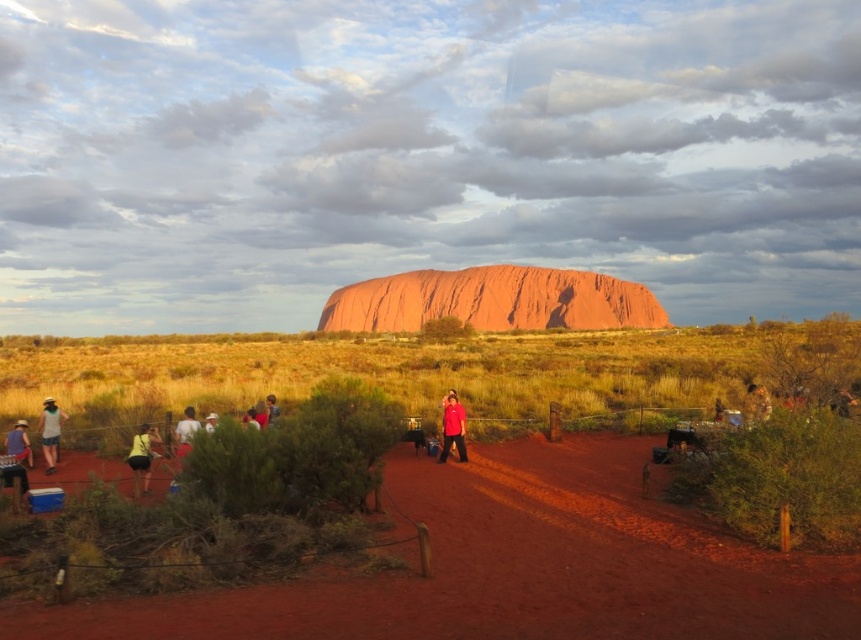
Question: Which point is farther from the camera taking this photo?

Choices:
 (A) (627, 508)
 (B) (141, 465)
 (C) (25, 438)
 (D) (184, 426)

Answer: (C)

Question: Which object is positioned closest to the denim jacket at lower left?

Choices:
 (A) red rock desert at center
 (B) matte yellow shorts at lower left
 (C) light brown leather jacket at center

Answer: (B)

Question: Which point appears closest to the camera in this image?

Choices:
 (A) (450, 422)
 (B) (178, 428)
 (C) (159, 614)

Answer: (C)

Question: Does red rock desert at center have a larger size compared to matte red shirt at center?

Choices:
 (A) yes
 (B) no

Answer: (A)

Question: Can you confirm if red rock desert at center is positioned to the right of denim jacket at lower left?

Choices:
 (A) yes
 (B) no

Answer: (A)

Question: Can you confirm if matte red shirt at center is positioned to the left of matte yellow shorts at lower left?

Choices:
 (A) no
 (B) yes

Answer: (A)